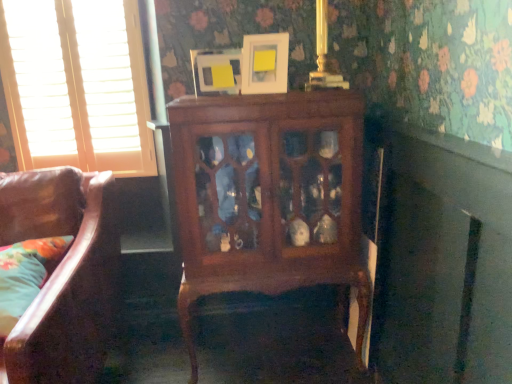
Where is `free point in front of matte white picture frame at upper center, which appears as the 1th picture frame when viewed from the left`? The height and width of the screenshot is (384, 512). free point in front of matte white picture frame at upper center, which appears as the 1th picture frame when viewed from the left is located at coordinates (218, 101).